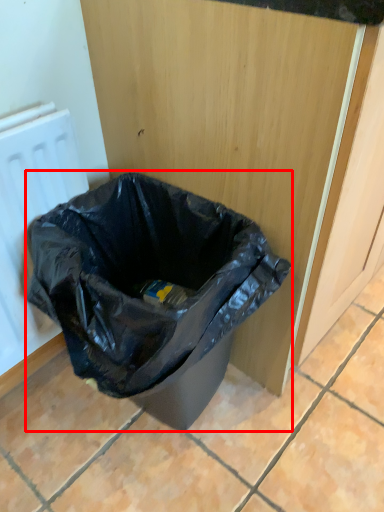
Question: From the image's perspective, where is waste container (annotated by the red box) located relative to radiator?

Choices:
 (A) below
 (B) above

Answer: (A)